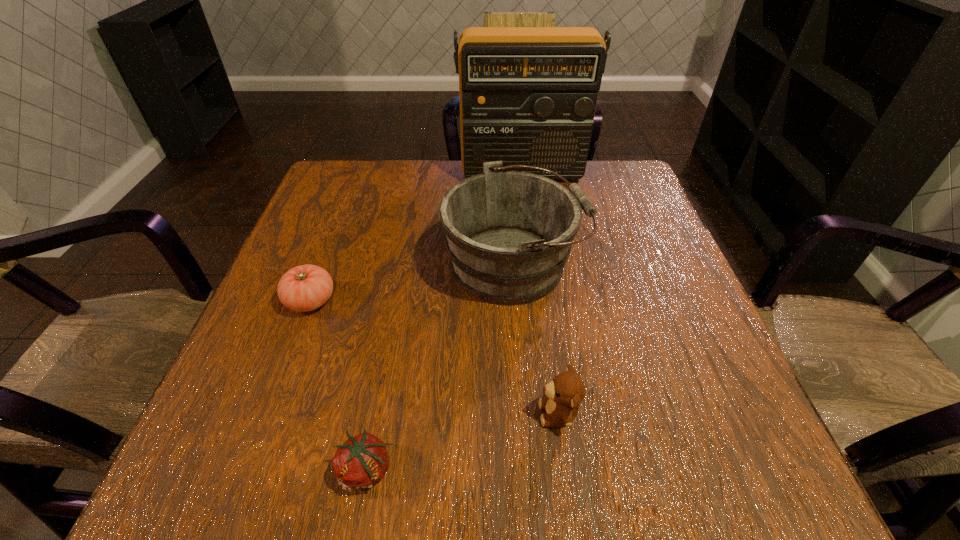
I want to click on empty space that is in between the teddy bear and the right tomato, so click(x=463, y=441).

Locate an element on the screen. free space between the left tomato and the teddy bear is located at coordinates (434, 357).

Identify the location of free point between the shorter tomato and the tallest object. (444, 321).

The width and height of the screenshot is (960, 540). What are the coordinates of `the fourth closest object to the leftmost object` in the screenshot? It's located at (528, 95).

I want to click on the fourth closest object to the second tallest object, so click(x=361, y=461).